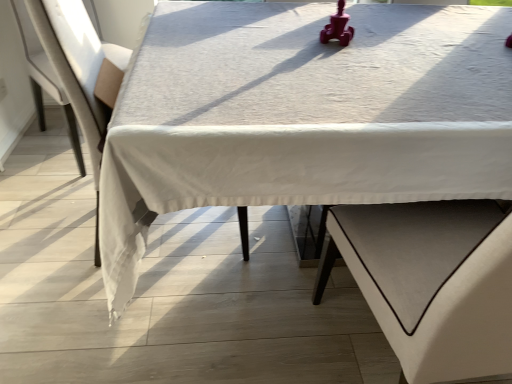
Question: From the image's perspective, is white fabric armchair at left located above or below white fabric table at center?

Choices:
 (A) below
 (B) above

Answer: (B)

Question: From a real-world perspective, is white fabric armchair at left physically located above or below white fabric table at center?

Choices:
 (A) below
 (B) above

Answer: (B)

Question: In terms of height, does white fabric armchair at left look taller or shorter compared to white fabric table at center?

Choices:
 (A) tall
 (B) short

Answer: (A)

Question: Based on their sizes in the image, would you say white fabric table at center is bigger or smaller than white fabric armchair at left?

Choices:
 (A) big
 (B) small

Answer: (A)

Question: Considering the positions of white fabric table at center and white fabric armchair at left in the image, is white fabric table at center wider or thinner than white fabric armchair at left?

Choices:
 (A) thin
 (B) wide

Answer: (B)

Question: From a real-world perspective, relative to white fabric armchair at left, is white fabric table at center vertically above or below?

Choices:
 (A) above
 (B) below

Answer: (B)

Question: From the image's perspective, is white fabric table at center above or below white fabric armchair at left?

Choices:
 (A) below
 (B) above

Answer: (A)